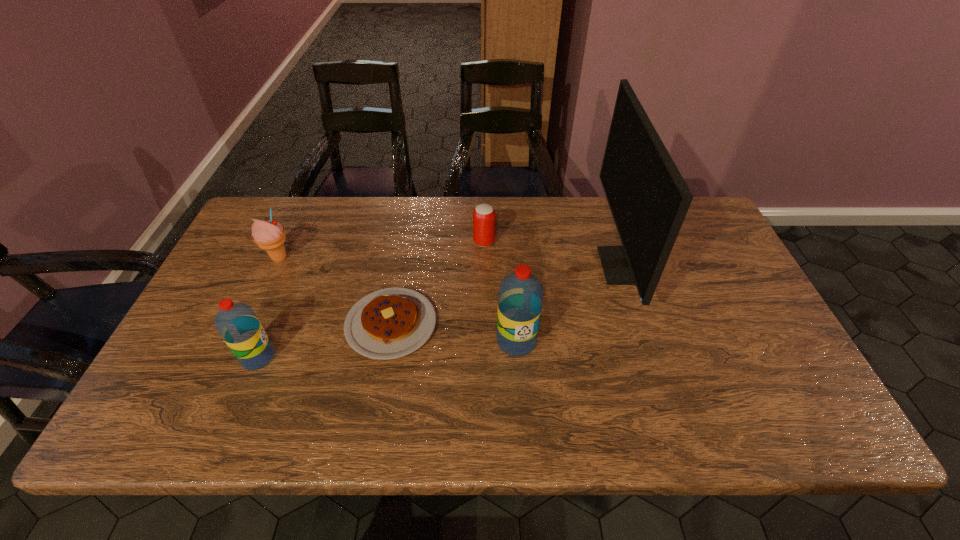
Image resolution: width=960 pixels, height=540 pixels. I want to click on vacant space that satisfies the following two spatial constraints: 1. on the back side of the second shortest object; 2. on the right side of the third shortest object, so click(287, 242).